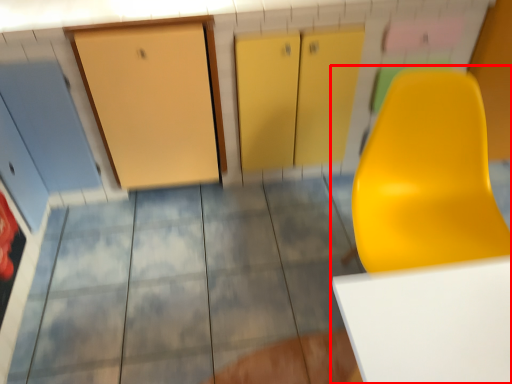
Question: From the image's perspective, what is the correct spatial positioning of furniture (annotated by the red box) in reference to tile?

Choices:
 (A) above
 (B) below

Answer: (A)